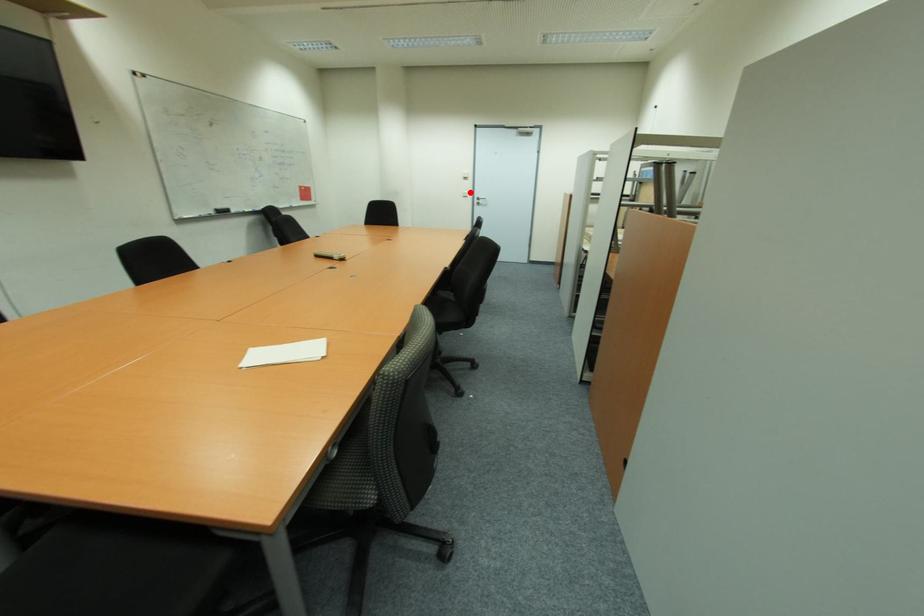
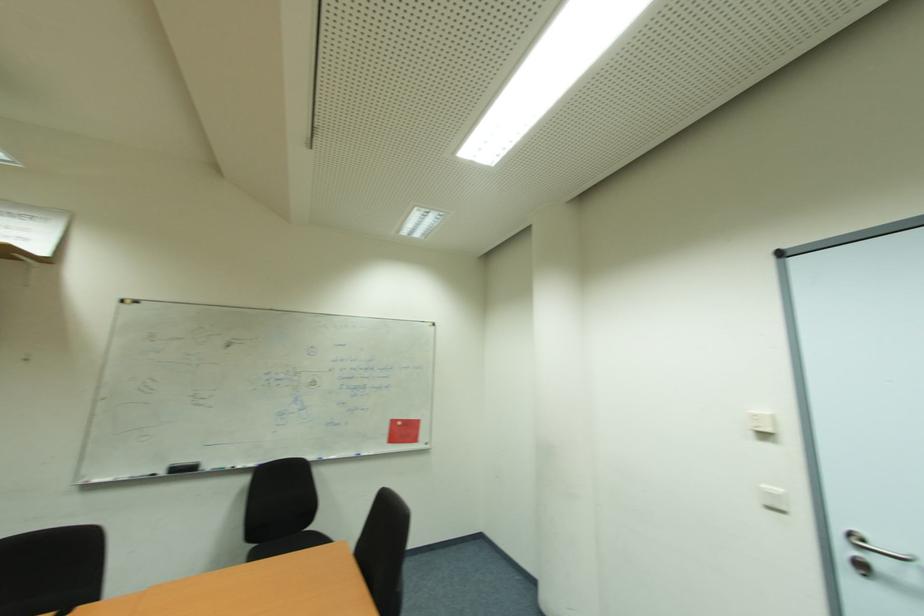
Question: I am providing you with two images of the same scene from different viewpoints. A red point is shown in image1. For the corresponding object point in image2, is it positioned nearer or farther from the camera?

Choices:
 (A) Nearer
 (B) Farther

Answer: (B)